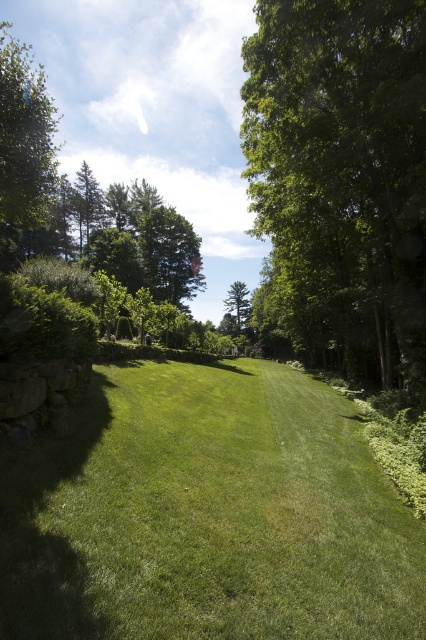
Question: Is green grassy at lower left further to camera compared to green leafy tree at center?

Choices:
 (A) no
 (B) yes

Answer: (A)

Question: Where is green grassy at lower left located in relation to green matte tree at center in the image?

Choices:
 (A) below
 (B) above

Answer: (A)

Question: Which object appears closest to the camera in this image?

Choices:
 (A) green leafy tree at upper left
 (B) green grassy at lower left
 (C) green matte tree at center

Answer: (B)

Question: Which object is closer to the camera taking this photo?

Choices:
 (A) green matte tree at center
 (B) green leafy tree at upper left

Answer: (B)

Question: Does green leafy tree at center appear on the right side of green leafy tree at upper left?

Choices:
 (A) yes
 (B) no

Answer: (A)

Question: Which of the following is the farthest from the observer?

Choices:
 (A) green leafy tree at center
 (B) green grassy at lower left
 (C) green leafy tree at upper left

Answer: (A)